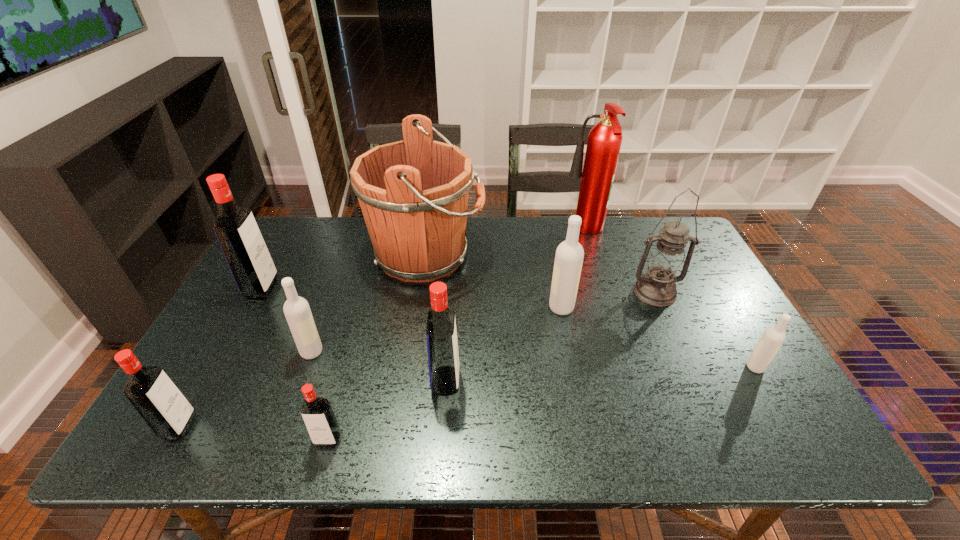
Identify the location of the fifth vodka from left to right. This screenshot has height=540, width=960. (443, 358).

Where is `the leftmost white vodka`? The height and width of the screenshot is (540, 960). the leftmost white vodka is located at coordinates (296, 309).

This screenshot has width=960, height=540. Identify the location of the eighth object from right to left. 296,309.

This screenshot has width=960, height=540. In order to click on the third biggest red vodka in this screenshot , I will do click(156, 398).

Locate an element on the screen. This screenshot has width=960, height=540. the smallest white vodka is located at coordinates (773, 338).

The height and width of the screenshot is (540, 960). I want to click on the rightmost white vodka, so click(773, 338).

Image resolution: width=960 pixels, height=540 pixels. In order to click on the fourth vodka from right to left in this screenshot , I will do `click(321, 423)`.

You are a GUI agent. You are given a task and a screenshot of the screen. Output one action in this format:
    pyautogui.click(x=<x>, y=<y>)
    Task: Click on the smallest red vodka
    
    Given the screenshot: What is the action you would take?
    pyautogui.click(x=321, y=423)

At what (x,y) coordinates should I click in order to perform the action: click on vacant space located 0.240m at the nozzle of the fire extinguisher. Please return your answer as a coordinate pair (x, y). Looking at the image, I should click on (494, 232).

Where is `vacant space positioned 0.080m at the nozzle of the fire extinguisher`? The width and height of the screenshot is (960, 540). vacant space positioned 0.080m at the nozzle of the fire extinguisher is located at coordinates (540, 232).